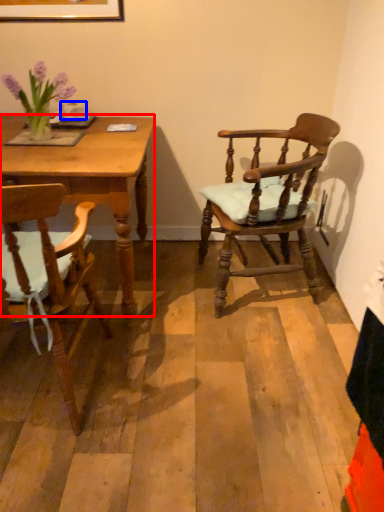
Question: Among these objects, which one is farthest to the camera, desk (highlighted by a red box) or coffee cup (highlighted by a blue box)?

Choices:
 (A) desk
 (B) coffee cup

Answer: (B)